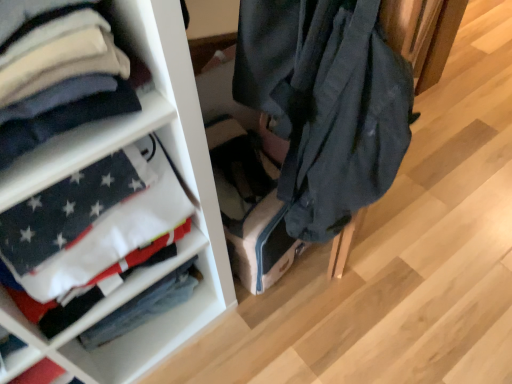
The width and height of the screenshot is (512, 384). What do you see at coordinates (144, 306) in the screenshot?
I see `white cotton flag at left` at bounding box center [144, 306].

You are a GUI agent. You are given a task and a screenshot of the screen. Output one action in this format:
    pyautogui.click(x=<x>, y=<y>)
    Task: Click on the white fabric at left
    This screenshot has width=512, height=384.
    Given the screenshot: What is the action you would take?
    pyautogui.click(x=176, y=185)

You are a GUI agent. You are given a task and a screenshot of the screen. Output one action in this format:
    pyautogui.click(x=<x>, y=<y>)
    Task: Click on the shelf that is above the white cotton flag at left (from a real-world perspective)
    This screenshot has height=384, width=512.
    Given the screenshot: What is the action you would take?
    pyautogui.click(x=176, y=185)

Is white cotton flag at left behind white fabric at left?

Yes, the depth of white cotton flag at left is greater than that of white fabric at left.

Would you say white cotton flag at left is a long distance from white fabric at left?

white cotton flag at left is actually quite close to white fabric at left.

From the image's perspective, is white cotton flag at left positioned above or below white fabric at left?

From the image's perspective, white cotton flag at left appears below white fabric at left.

From a real-world perspective, which object stands above the other?

From a 3D spatial view, white cotton shirt at left is above.

Considering the relative sizes of white cotton shirt at left and white cotton flag at left in the image provided, is white cotton shirt at left shorter than white cotton flag at left?

In fact, white cotton shirt at left may be taller than white cotton flag at left.

Considering the relative sizes of white cotton shirt at left and white cotton flag at left in the image provided, is white cotton shirt at left smaller than white cotton flag at left?

No.

Which is in front, point (39, 116) or point (139, 303)?

The point (39, 116) is closer to the camera.

Could you tell me if white cotton shirt at left is turned towards white fabric at left?

No, white cotton shirt at left does not turn towards white fabric at left.

Which is nearer, (125,92) or (179,78)?

The point (125,92) is closer to the camera.

Is white cotton shirt at left positioned in front of white fabric at left?

Yes, it is.

Is white fabric at left spatially inside white cotton shirt at left, or outside of it?

white fabric at left is located beyond the bounds of white cotton shirt at left.

Based on the photo, which of these two, white fabric at left or white cotton shirt at left, is wider?

Wider between the two is white cotton shirt at left.

In terms of size, does white fabric at left appear bigger or smaller than white cotton shirt at left?

Considering their sizes, white fabric at left takes up more space than white cotton shirt at left.

Looking at this image, which object is positioned more to the left, white fabric at left or white cotton shirt at left?

white cotton shirt at left is more to the left.

Between point (197, 244) and point (144, 317), which one is positioned behind?

The point (144, 317) is more distant.

Can you confirm if white fabric at left is smaller than white cotton flag at left?

No.

This screenshot has width=512, height=384. I want to click on shelf that is above the white cotton flag at left (from a real-world perspective), so click(x=176, y=185).

Is white fabric at left situated inside white cotton flag at left or outside?

white fabric at left is outside white cotton flag at left.

Considering the relative sizes of white cotton flag at left and white cotton shirt at left in the image provided, is white cotton flag at left shorter than white cotton shirt at left?

Yes, white cotton flag at left is shorter than white cotton shirt at left.

From the image's perspective, is white cotton flag at left positioned above or below white cotton shirt at left?

From the image's perspective, white cotton flag at left appears below white cotton shirt at left.

Is white cotton flag at left not close to white cotton shirt at left?

That's not correct — white cotton flag at left is a little close to white cotton shirt at left.

Is white cotton flag at left looking in the opposite direction of white cotton shirt at left?

white cotton flag at left is not turned away from white cotton shirt at left.

You are a GUI agent. You are given a task and a screenshot of the screen. Output one action in this format:
    pyautogui.click(x=<x>, y=<y>)
    Task: Click on the flag located on the right of white fabric at left
    This screenshot has width=512, height=384.
    Given the screenshot: What is the action you would take?
    pyautogui.click(x=144, y=306)

The width and height of the screenshot is (512, 384). I want to click on cloak on the left of white cotton flag at left, so click(63, 120).

Based on their spatial positions, is white fabric at left or white cotton flag at left closer to white cotton shirt at left?

white fabric at left.

Estimate the real-world distances between objects in this image. Which object is further from white cotton flag at left, white fabric at left or white cotton shirt at left?

white cotton shirt at left lies further to white cotton flag at left than the other object.

Estimate the real-world distances between objects in this image. Which object is closer to white fabric at left, white cotton flag at left or white cotton shirt at left?

Based on the image, white cotton flag at left appears to be nearer to white fabric at left.

From the image, which object appears to be nearer to white cotton shirt at left, white cotton flag at left or white fabric at left?

white fabric at left lies closer to white cotton shirt at left than the other object.

Looking at the image, which one is located closer to white cotton flag at left, white cotton shirt at left or white fabric at left?

The object closer to white cotton flag at left is white fabric at left.

Estimate the real-world distances between objects in this image. Which object is closer to white fabric at left, white cotton shirt at left or white cotton flag at left?

Based on the image, white cotton flag at left appears to be nearer to white fabric at left.

You are a GUI agent. You are given a task and a screenshot of the screen. Output one action in this format:
    pyautogui.click(x=<x>, y=<y>)
    Task: Click on the shelf located between white cotton shirt at left and white cotton flag at left in the depth direction
    The image size is (512, 384).
    Given the screenshot: What is the action you would take?
    pyautogui.click(x=176, y=185)